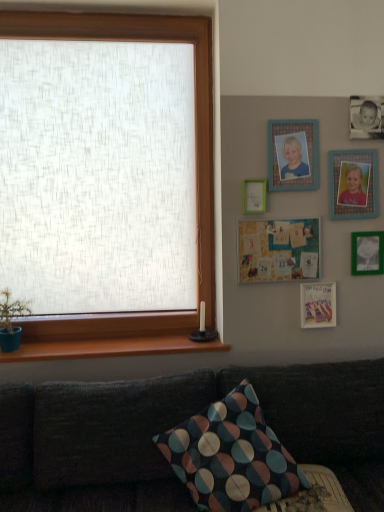
Measure the distance between green matte picture frame at upper center, which is the 3th picture frame from top to bottom, and camera.

The depth of green matte picture frame at upper center, which is the 3th picture frame from top to bottom, is 2.04 meters.

The image size is (384, 512). Describe the element at coordinates (278, 250) in the screenshot. I see `wooden bulletin board at upper right, placed as the 4th picture frame when sorted from top to bottom` at that location.

Image resolution: width=384 pixels, height=512 pixels. Describe the element at coordinates (231, 455) in the screenshot. I see `multicolored fabric pillow at lower center` at that location.

Describe the element at coordinates (367, 253) in the screenshot. This screenshot has height=512, width=384. I see `green matte picture frame at lower right, which is the 5th picture frame from top to bottom` at that location.

What do you see at coordinates (318, 304) in the screenshot? This screenshot has width=384, height=512. I see `matte paper picture frame at lower right, arranged as the first picture frame when ordered from the bottom` at bounding box center [318, 304].

This screenshot has width=384, height=512. What do you see at coordinates (111, 348) in the screenshot?
I see `wooden at lower left` at bounding box center [111, 348].

Locate an element on the screen. green matte plant at lower left is located at coordinates (11, 310).

Is multicolored fabric pillow at lower center located outside wooden at lower left?

Yes, multicolored fabric pillow at lower center is outside of wooden at lower left.

Considering the positions of point (187, 484) and point (4, 356), is point (187, 484) closer or farther from the camera than point (4, 356)?

Clearly, point (187, 484) is closer to the camera than point (4, 356).

Measure the distance from multicolored fabric pillow at lower center to wooden at lower left.

multicolored fabric pillow at lower center and wooden at lower left are 22.57 inches apart.

Looking at this image, which is in front, multicolored fabric pillow at lower center or wooden at lower left?

multicolored fabric pillow at lower center is closer to the camera.

From a real-world perspective, is multicolored fabric pillow at lower center located higher than wooden photo frame at upper right, marked as the 5th picture frame in a bottom-to-top arrangement?

No, from a real-world perspective, multicolored fabric pillow at lower center is not on top of wooden photo frame at upper right, marked as the 5th picture frame in a bottom-to-top arrangement.

Considering the sizes of multicolored fabric pillow at lower center and wooden photo frame at upper right, the second picture frame in the top-to-bottom sequence, in the image, is multicolored fabric pillow at lower center wider or thinner than wooden photo frame at upper right, the second picture frame in the top-to-bottom sequence,?

Considering their sizes, multicolored fabric pillow at lower center looks broader than wooden photo frame at upper right, the second picture frame in the top-to-bottom sequence.

Between point (167, 446) and point (350, 159), which one is positioned behind?

The point (350, 159) is more distant.

Can we say multicolored fabric pillow at lower center lies outside wooden photo frame at upper right, marked as the 5th picture frame in a bottom-to-top arrangement?

Yes, multicolored fabric pillow at lower center is not within wooden photo frame at upper right, marked as the 5th picture frame in a bottom-to-top arrangement.

From the image's perspective, which is above, multicolored fabric pillow at lower center or green matte plant at lower left?

green matte plant at lower left is shown above in the image.

Is multicolored fabric pillow at lower center situated inside green matte plant at lower left or outside?

multicolored fabric pillow at lower center is not enclosed by green matte plant at lower left.

Is multicolored fabric pillow at lower center facing towards green matte plant at lower left?

No.

Between multicolored fabric pillow at lower center and green matte plant at lower left, which one has larger size?

multicolored fabric pillow at lower center is bigger.

Considering the relative sizes of wooden at lower left and green matte picture frame at upper center, which is the 3th picture frame from top to bottom, in the image provided, is wooden at lower left taller than green matte picture frame at upper center, which is the 3th picture frame from top to bottom,?

No.

Which object is wider, wooden at lower left or green matte picture frame at upper center, which appears as the fourth picture frame when ordered from the bottom?

Wider between the two is wooden at lower left.

Which is closer, (147, 337) or (245, 184)?

Positioned in front is point (245, 184).

From a real-world perspective, which object stands above the other?

green matte picture frame at upper center, which is the 3th picture frame from top to bottom, from a real-world perspective.

From the image's perspective, is blue wooden photo frame at upper center, arranged as the sixth picture frame when ordered from the bottom, above or below dark fabric couch at lower left?

blue wooden photo frame at upper center, arranged as the sixth picture frame when ordered from the bottom, is situated higher than dark fabric couch at lower left in the image.

Relative to dark fabric couch at lower left, is blue wooden photo frame at upper center, arranged as the sixth picture frame when ordered from the bottom, in front or behind?

blue wooden photo frame at upper center, arranged as the sixth picture frame when ordered from the bottom, is behind dark fabric couch at lower left.

In the scene shown: Considering the relative sizes of blue wooden photo frame at upper center, which is the 1th picture frame in top-to-bottom order, and dark fabric couch at lower left in the image provided, is blue wooden photo frame at upper center, which is the 1th picture frame in top-to-bottom order, thinner than dark fabric couch at lower left?

Correct, the width of blue wooden photo frame at upper center, which is the 1th picture frame in top-to-bottom order, is less than that of dark fabric couch at lower left.

Find the location of a particular element. the 3rd picture frame counting from the left side of the green matte picture frame at lower right, which is counted as the 2th picture frame, starting from the bottom is located at coordinates (293, 155).

From the image's perspective, would you say blue wooden photo frame at upper center, arranged as the sixth picture frame when ordered from the bottom, is shown under green matte picture frame at lower right, which is the 5th picture frame from top to bottom?

Incorrect, from the image's perspective, blue wooden photo frame at upper center, arranged as the sixth picture frame when ordered from the bottom, is higher than green matte picture frame at lower right, which is the 5th picture frame from top to bottom.

In the scene shown: Is blue wooden photo frame at upper center, arranged as the sixth picture frame when ordered from the bottom, not near green matte picture frame at lower right, which is counted as the 2th picture frame, starting from the bottom?

Actually, blue wooden photo frame at upper center, arranged as the sixth picture frame when ordered from the bottom, and green matte picture frame at lower right, which is counted as the 2th picture frame, starting from the bottom, are a little close together.

Can you confirm if blue wooden photo frame at upper center, which is the 1th picture frame in top-to-bottom order, is smaller than green matte picture frame at lower right, which is counted as the 2th picture frame, starting from the bottom?

Actually, blue wooden photo frame at upper center, which is the 1th picture frame in top-to-bottom order, might be larger than green matte picture frame at lower right, which is counted as the 2th picture frame, starting from the bottom.

From the image's perspective, count 6th picture frames upward from the multicolored fabric pillow at lower center and point to it. Please provide its 2D coordinates.

[(293, 155)]

Is point (222, 403) farther from viewer compared to point (315, 182)?

No, (222, 403) is closer to viewer.

From the image's perspective, which object appears higher, multicolored fabric pillow at lower center or blue wooden photo frame at upper center, which is the 1th picture frame in top-to-bottom order?

blue wooden photo frame at upper center, which is the 1th picture frame in top-to-bottom order, is shown above in the image.

Find the location of a particular element. window sill on the left of multicolored fabric pillow at lower center is located at coordinates (111, 348).

I want to click on the 5th picture frame above the multicolored fabric pillow at lower center (from the image's perspective), so click(x=353, y=184).

Looking at this image, based on their spatial positions, is dark fabric couch at lower left or green matte plant at lower left further from wooden bulletin board at upper right, placed as the 4th picture frame when sorted from top to bottom?

green matte plant at lower left lies further to wooden bulletin board at upper right, placed as the 4th picture frame when sorted from top to bottom, than the other object.

When comparing their distances from dark fabric couch at lower left, does green matte plant at lower left or multicolored fabric pillow at lower center seem further?

green matte plant at lower left lies further to dark fabric couch at lower left than the other object.

From the image, which object appears to be farther from multicolored fabric pillow at lower center, blue wooden photo frame at upper center, arranged as the sixth picture frame when ordered from the bottom, or green matte picture frame at upper center, which is the 3th picture frame from top to bottom?

blue wooden photo frame at upper center, arranged as the sixth picture frame when ordered from the bottom, is positioned further to the anchor multicolored fabric pillow at lower center.

Based on their spatial positions, is blue wooden photo frame at upper center, arranged as the sixth picture frame when ordered from the bottom, or dark fabric couch at lower left closer to multicolored fabric pillow at lower center?

dark fabric couch at lower left is closer to multicolored fabric pillow at lower center.

Considering their positions, is multicolored fabric pillow at lower center positioned further to wooden bulletin board at upper right, placed as the 4th picture frame when sorted from top to bottom, than green matte picture frame at upper center, which is the 3th picture frame from top to bottom?

multicolored fabric pillow at lower center is further to wooden bulletin board at upper right, placed as the 4th picture frame when sorted from top to bottom.

Based on their spatial positions, is blue wooden photo frame at upper center, arranged as the sixth picture frame when ordered from the bottom, or green matte plant at lower left further from multicolored fabric pillow at lower center?

The object further to multicolored fabric pillow at lower center is blue wooden photo frame at upper center, arranged as the sixth picture frame when ordered from the bottom.

Estimate the real-world distances between objects in this image. Which object is further from green matte picture frame at lower right, which is the 5th picture frame from top to bottom, blue wooden photo frame at upper center, arranged as the sixth picture frame when ordered from the bottom, or green matte picture frame at upper center, which is the 3th picture frame from top to bottom?

Among the two, green matte picture frame at upper center, which is the 3th picture frame from top to bottom, is located further to green matte picture frame at lower right, which is the 5th picture frame from top to bottom.

From the image, which object appears to be farther from dark fabric couch at lower left, matte paper picture frame at lower right, arranged as the first picture frame when ordered from the bottom, or green matte picture frame at lower right, which is counted as the 2th picture frame, starting from the bottom?

green matte picture frame at lower right, which is counted as the 2th picture frame, starting from the bottom, is positioned further to the anchor dark fabric couch at lower left.

The width and height of the screenshot is (384, 512). I want to click on pillow between wooden photo frame at upper right, the second picture frame in the top-to-bottom sequence, and dark fabric couch at lower left vertically, so click(231, 455).

You are a GUI agent. You are given a task and a screenshot of the screen. Output one action in this format:
    pyautogui.click(x=<x>, y=<y>)
    Task: Click on the window sill between green matte plant at lower left and green matte picture frame at lower right, which is counted as the 2th picture frame, starting from the bottom, in the horizontal direction
    The image size is (384, 512).
    Given the screenshot: What is the action you would take?
    coord(111,348)

I want to click on window sill between green matte plant at lower left and blue wooden photo frame at upper center, arranged as the sixth picture frame when ordered from the bottom, so click(x=111, y=348).

Find the location of `plant between green matte picture frame at upper center, which appears as the fourth picture frame when ordered from the bottom, and dark fabric couch at lower left in the up-down direction`. plant between green matte picture frame at upper center, which appears as the fourth picture frame when ordered from the bottom, and dark fabric couch at lower left in the up-down direction is located at coordinates (11, 310).